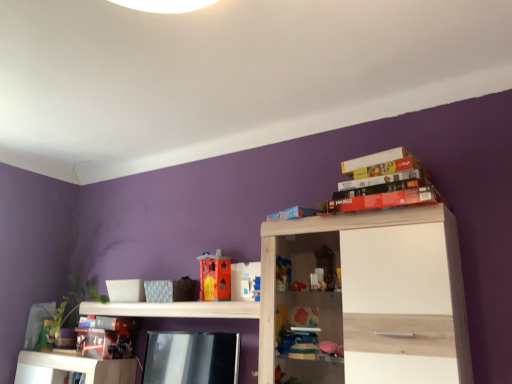
Question: Is matte cardboard book at upper right, which is the 1th book from top to bottom, at the right side of plastic toy castle at center, which is counted as the second toy, starting from the right?

Choices:
 (A) yes
 (B) no

Answer: (A)

Question: Does matte cardboard book at upper right, which is the 1th book from top to bottom, have a greater height compared to plastic toy castle at center, the 2th toy in the front-to-back sequence?

Choices:
 (A) no
 (B) yes

Answer: (A)

Question: Is matte cardboard book at upper right, which ranks as the fifth book in bottom-to-top order, not inside plastic toy castle at center, which is counted as the second toy, starting from the right?

Choices:
 (A) yes
 (B) no

Answer: (A)

Question: From a real-world perspective, is matte cardboard book at upper right, which ranks as the fifth book in bottom-to-top order, physically above plastic toy castle at center, which is counted as the second toy, starting from the right?

Choices:
 (A) no
 (B) yes

Answer: (B)

Question: Can plastic toy castle at center, which ranks as the 2th toy in left-to-right order, be found inside matte cardboard book at upper right, which is the 1th book from top to bottom?

Choices:
 (A) yes
 (B) no

Answer: (B)

Question: Relative to translucent plastic toy at lower left, which appears as the 3th toy when viewed from the front, is white wood shelf at center, which ranks as the 1th shelf in left-to-right order, in front or behind?

Choices:
 (A) behind
 (B) front

Answer: (B)

Question: Considering the positions of white wood shelf at center, which ranks as the 1th shelf in left-to-right order, and translucent plastic toy at lower left, the 3th toy when ordered from right to left, in the image, is white wood shelf at center, which ranks as the 1th shelf in left-to-right order, wider or thinner than translucent plastic toy at lower left, the 3th toy when ordered from right to left,?

Choices:
 (A) thin
 (B) wide

Answer: (B)

Question: Is white wood shelf at center, which ranks as the 1th shelf in left-to-right order, inside the boundaries of translucent plastic toy at lower left, the 3th toy when ordered from right to left, or outside?

Choices:
 (A) inside
 (B) outside

Answer: (B)

Question: Is point (133, 311) closer or farther from the camera than point (48, 321)?

Choices:
 (A) closer
 (B) farther

Answer: (A)

Question: Is point (402, 193) positioned closer to the camera than point (390, 155)?

Choices:
 (A) farther
 (B) closer

Answer: (B)

Question: Would you say matte red lego box at upper right, the 3th book from the top, is to the left or to the right of matte cardboard book at upper right, which is the 1th book from top to bottom, in the picture?

Choices:
 (A) left
 (B) right

Answer: (A)

Question: From the image's perspective, relative to matte cardboard book at upper right, which is the 1th book from top to bottom, is matte red lego box at upper right, the 3th book from the top, above or below?

Choices:
 (A) below
 (B) above

Answer: (A)

Question: In terms of height, does matte red lego box at upper right, which is the third book in bottom-to-top order, look taller or shorter compared to matte cardboard book at upper right, which is the 1th book from top to bottom?

Choices:
 (A) tall
 (B) short

Answer: (B)

Question: From a real-world perspective, is white plastic toy at center, which ranks as the 1th toy in right-to-left order, positioned above or below translucent plastic toy at lower left, which is counted as the first toy, starting from the left?

Choices:
 (A) below
 (B) above

Answer: (B)

Question: Would you say white plastic toy at center, which ranks as the 1th toy in right-to-left order, is to the left or to the right of translucent plastic toy at lower left, the third toy in the top-to-bottom sequence, in the picture?

Choices:
 (A) left
 (B) right

Answer: (B)